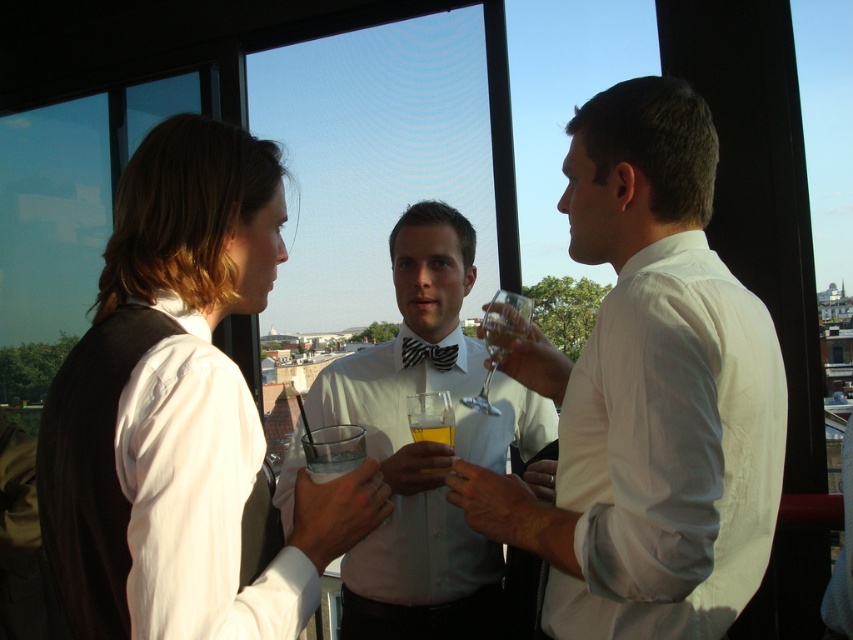
You are a photographer trying to capture a closeup shot of the clear glass at center without including the matte white shirt at center in the frame. Given their sizes, is this possible?

The matte white shirt at center is bigger than the clear glass at center, so it might be challenging to frame the clear glass at center without including the matte white shirt at center due to its larger size.

You are a photographer trying to capture a candid shot of the matte white shirt at center and the clear glass at center. Since the camera can only focus on one object at a time, which one should you focus on to ensure it appears sharp in the photo?

→ The matte white shirt at center is closer to the viewer than the clear glass at center, so focusing on the matte white shirt at center will ensure it appears sharp, while the clear glass at center may appear slightly out of focus.

In the scene, you see a white glossy bow tie at center and a clear glass at center. Which object is positioned to the right of the other?

The white glossy bow tie at center is to the right of the clear glass at center.